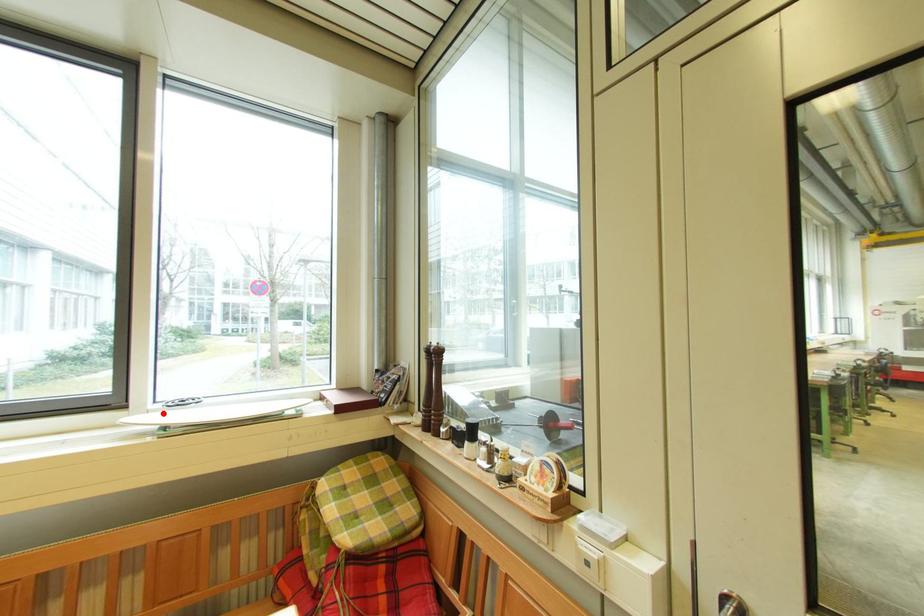
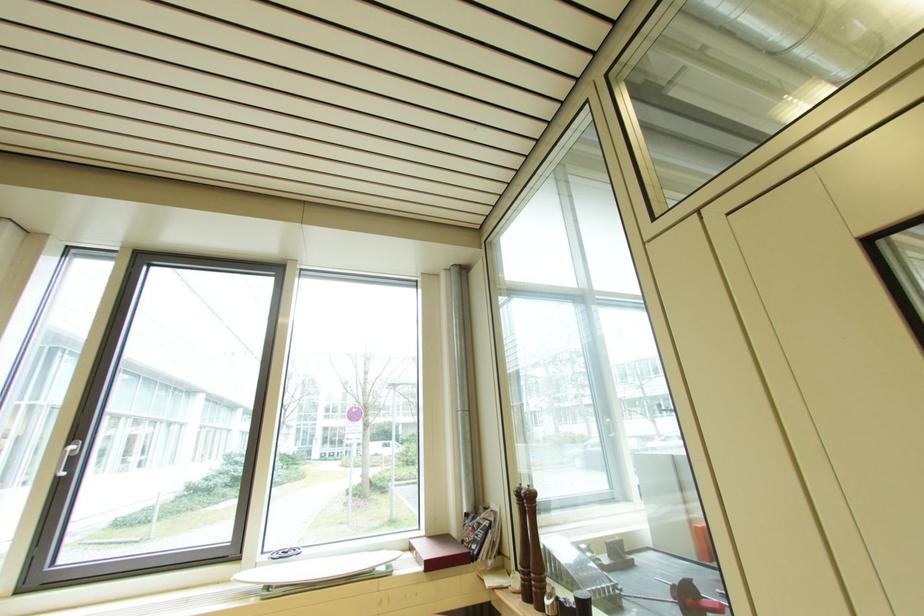
Find the pixel in the second image that matches the highlighted location in the first image.

(271, 567)